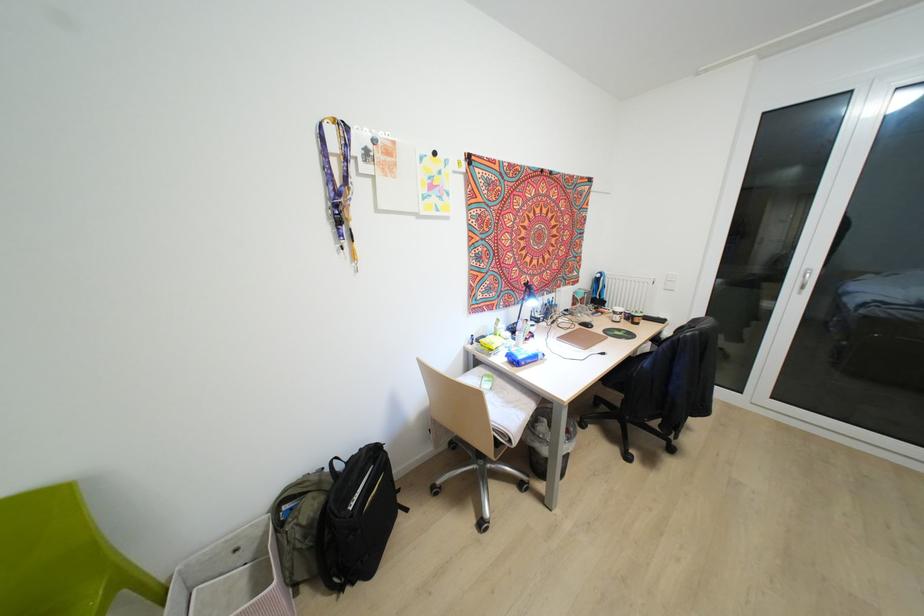
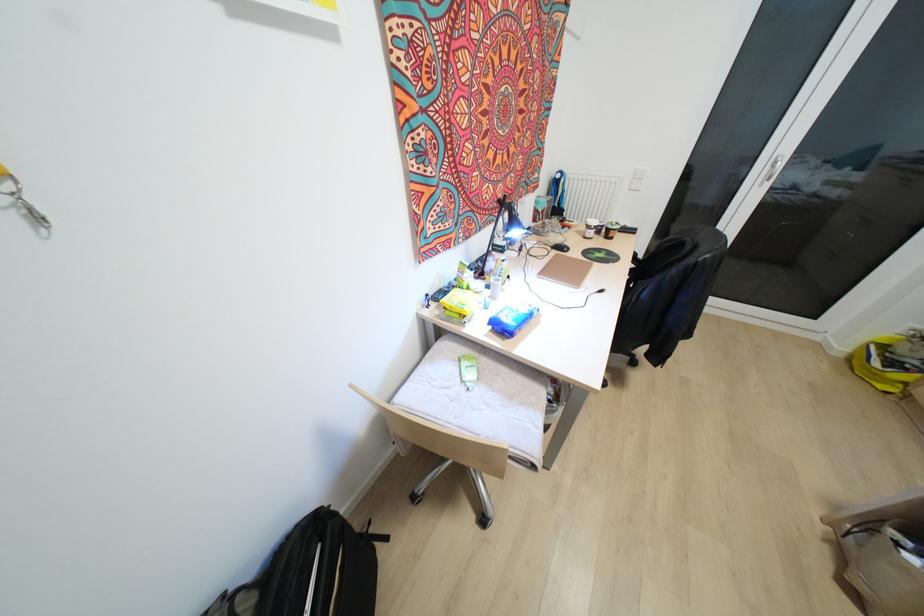
Question: I am providing you with two images of the same scene from different viewpoints. Which of the following objects are not visible in image2?

Choices:
 (A) black chair armrest
 (B) toilet paper piece
 (C) paper cup
 (D) blue wipes package

Answer: (A)